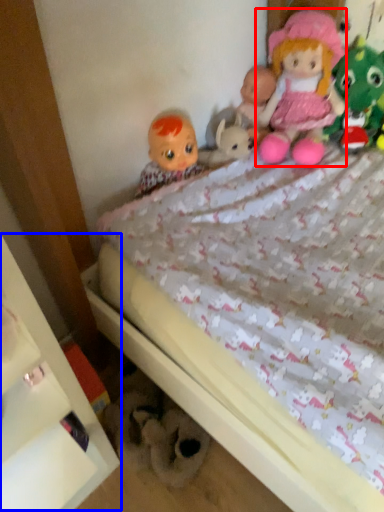
Question: Which point is closer to the camera, doll (highlighted by a red box) or shelf (highlighted by a blue box)?

Choices:
 (A) doll
 (B) shelf

Answer: (B)